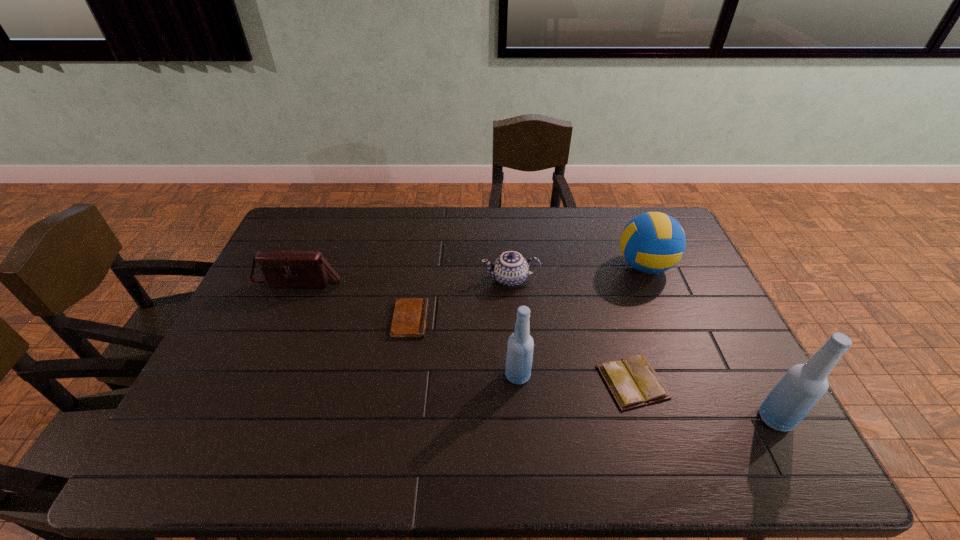
Locate an element on the screen. bottle located at the near edge is located at coordinates (803, 385).

You are a GUI agent. You are given a task and a screenshot of the screen. Output one action in this format:
    pyautogui.click(x=<x>, y=<y>)
    Task: Click on the diary present at the near edge
    
    Given the screenshot: What is the action you would take?
    pyautogui.click(x=633, y=382)

Where is `object that is at the left edge`? object that is at the left edge is located at coordinates (280, 269).

I want to click on bottle present at the right edge, so click(803, 385).

You are a GUI agent. You are given a task and a screenshot of the screen. Output one action in this format:
    pyautogui.click(x=<x>, y=<y>)
    Task: Click on the volleyball located in the right edge section of the desktop
    This screenshot has height=540, width=960.
    Given the screenshot: What is the action you would take?
    pyautogui.click(x=653, y=242)

Find the location of a particular element. object located at the near right corner is located at coordinates (803, 385).

Locate an element on the screen. The height and width of the screenshot is (540, 960). free region at the far edge is located at coordinates (399, 217).

Locate an element on the screen. The image size is (960, 540). vacant space at the near edge of the desktop is located at coordinates (270, 414).

Find the location of a particular element. vacant space at the left edge of the desktop is located at coordinates (284, 292).

In order to click on vacant area at the right edge in this screenshot , I will do `click(750, 387)`.